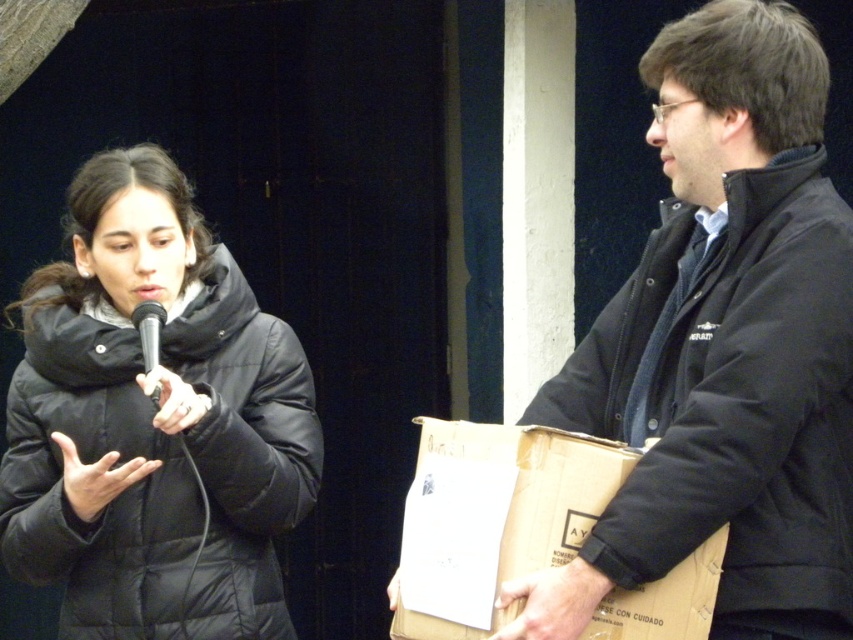
Question: Can you confirm if black quilted jacket at right is thinner than brown cardboard box at right?

Choices:
 (A) yes
 (B) no

Answer: (A)

Question: Which object is the farthest from the black matte microphone at center?

Choices:
 (A) brown cardboard box at right
 (B) black quilted jacket at right
 (C) black puffy jacket at center

Answer: (B)

Question: Considering the real-world distances, which object is closest to the black puffy jacket at center?

Choices:
 (A) black matte microphone at center
 (B) black quilted jacket at right
 (C) brown cardboard box at right

Answer: (A)

Question: Can you confirm if black quilted jacket at right is wider than black puffy jacket at center?

Choices:
 (A) yes
 (B) no

Answer: (B)

Question: Does black puffy jacket at center have a smaller size compared to brown cardboard box at right?

Choices:
 (A) no
 (B) yes

Answer: (A)

Question: Among these points, which one is farthest from the camera?

Choices:
 (A) [x=152, y=356]
 (B) [x=424, y=470]
 (C) [x=318, y=481]
 (D) [x=712, y=468]

Answer: (C)